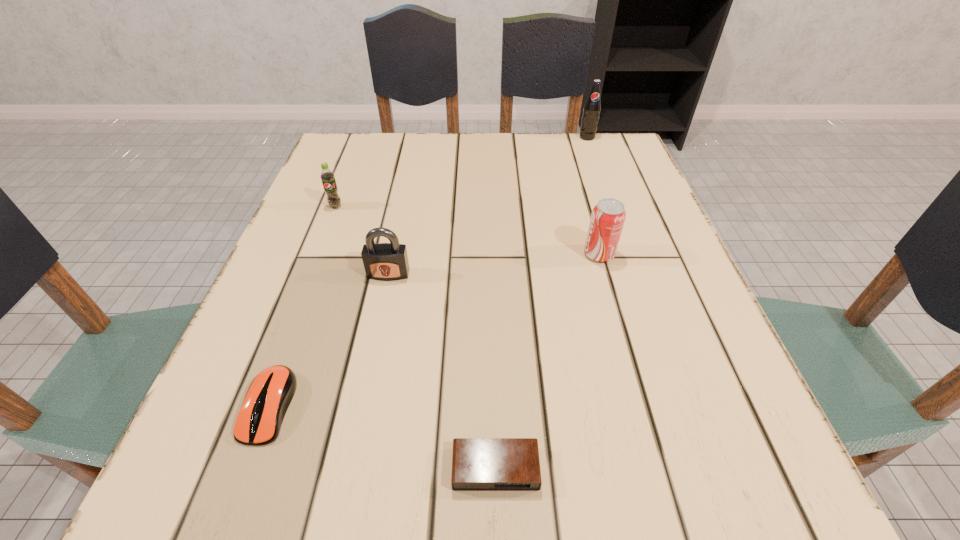
The height and width of the screenshot is (540, 960). In order to click on vacant space that is in between the third object from left to right and the fourth object from left to right in this screenshot , I will do `click(442, 372)`.

Find the location of a particular element. This screenshot has height=540, width=960. vacant space that is in between the shortest object and the fifth nearest object is located at coordinates (416, 338).

Find the location of a particular element. This screenshot has width=960, height=540. vacant region between the leftmost soda and the alarm clock is located at coordinates (416, 338).

Where is `free space between the third farthest object and the fourth farthest object`? free space between the third farthest object and the fourth farthest object is located at coordinates (493, 264).

Identify the location of free space between the fourth object from right to left and the nearest soda. 493,264.

At what (x,y) coordinates should I click in order to perform the action: click on empty space that is in between the farthest object and the fourth farthest object. Please return your answer as a coordinate pair (x, y). The image size is (960, 540). Looking at the image, I should click on (488, 206).

In order to click on vacant area between the fifth nearest object and the computer mouse in this screenshot , I will do `click(302, 306)`.

Where is `empty location between the second object from right to left and the farthest soda`? This screenshot has width=960, height=540. empty location between the second object from right to left and the farthest soda is located at coordinates (593, 195).

This screenshot has width=960, height=540. Identify the location of unoccupied position between the second soda from left to right and the padlock. (493, 264).

Choose which object is the nearest neighbor to the second object from right to left. Please provide its 2D coordinates. Your answer should be formatted as a tuple, i.e. [(x, y)], where the tuple contains the x and y coordinates of a point satisfying the conditions above.

[(382, 261)]